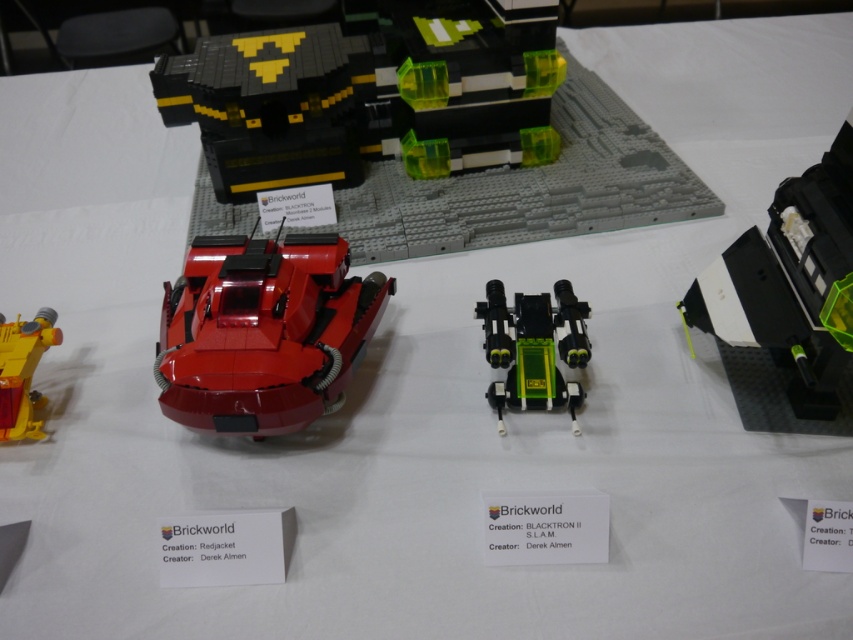
You are a guest at the LEGO exhibition and want to take a photo of both the shiny red car at center and the yellow plastic helicopter at left. Since you can only focus on one object at a time, which one should you aim your camera at first to ensure both are in the frame?

The shiny red car at center is located above the yellow plastic helicopter at left, so you should aim your camera at the shiny red car at center first to ensure both are in the frame.

You are a LEGO enthusiast attending Brickworld and want to place a new LEGO set between the shiny red car at center and the yellow plastic helicopter at left. The new set requires a minimum of 12 inches of space. Can you fit it between them?

The distance between the shiny red car at center and the yellow plastic helicopter at left is 13.89 inches, which is more than the required 12 inches. Yes, you can fit the new LEGO set between them.